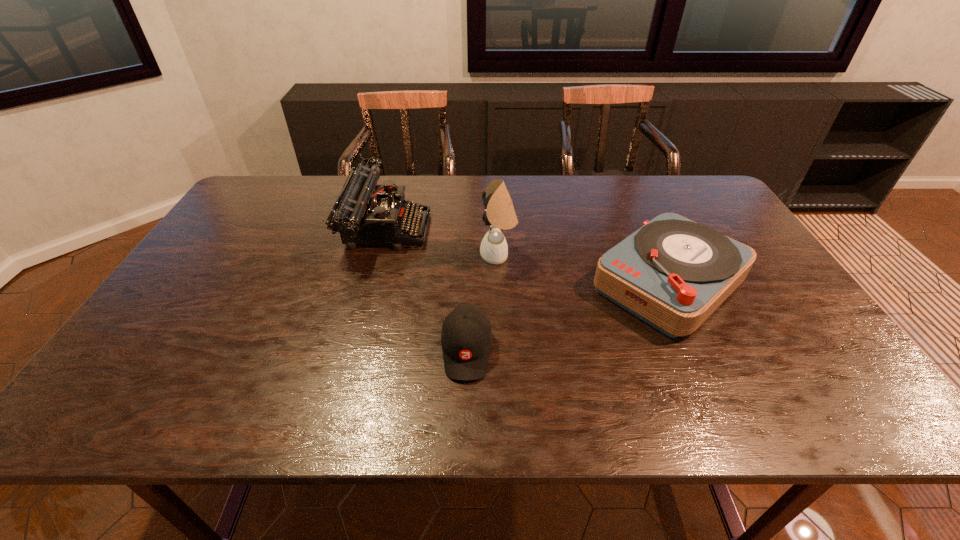
Where is `free space between the third tallest object and the doll`? This screenshot has height=540, width=960. free space between the third tallest object and the doll is located at coordinates (584, 269).

Find the location of a particular element. This screenshot has height=540, width=960. unoccupied area between the shortest object and the typewriter is located at coordinates (426, 289).

Locate an element on the screen. The image size is (960, 540). empty location between the tallest object and the typewriter is located at coordinates (442, 242).

Identify the location of unoccupied position between the third tallest object and the shortest object. This screenshot has height=540, width=960. (567, 316).

I want to click on vacant space in between the doll and the record player, so click(584, 269).

At what (x,y) coordinates should I click in order to perform the action: click on free space that is in between the tallest object and the record player. Please return your answer as a coordinate pair (x, y). Looking at the image, I should click on (584, 269).

In order to click on vacant area that lies between the baseball cap and the third shortest object in this screenshot , I will do `click(426, 289)`.

The height and width of the screenshot is (540, 960). Find the location of `vacant area that lies between the typewriter and the rightmost object`. vacant area that lies between the typewriter and the rightmost object is located at coordinates (527, 255).

The width and height of the screenshot is (960, 540). In order to click on unoccupied area between the second shortest object and the leftmost object in this screenshot , I will do `click(527, 255)`.

In order to click on vacant region between the baseball cap and the second tallest object in this screenshot , I will do `click(426, 289)`.